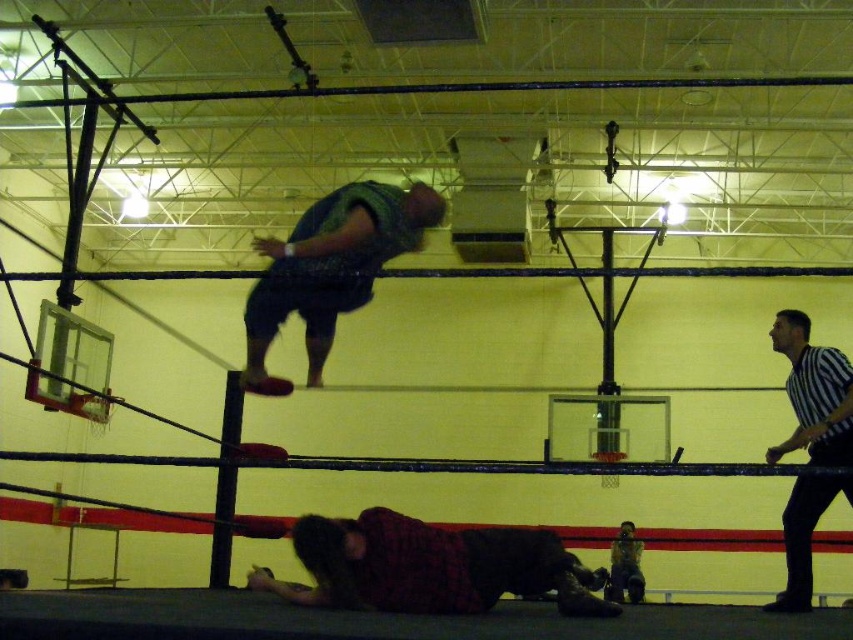
Based on the scene description, where is the plaid shirt at lower center located in the image?

The plaid shirt at lower center is located at point coordinates of 0.886 on the x axis and 0.504 on the y axis.

You are a referee in the gymnasium. You need to ensure the wrestlers are within the ring, which has a 1.5 meter radius. Can you confirm if both the plaid shirt at lower center and the green textured shirt at upper center are inside the ring?

The distance between the plaid shirt at lower center and the green textured shirt at upper center is 1.28 meters, which is less than the ring radius of 1.5 meters. Therefore, both wrestlers are within the ring.

In the scene shown: You are a referee in the wrestling match. You need to ensure the wrestlers are within the ring boundaries. The ring is 2 meters in diameter. Are both the plaid shirt at lower center and the black striped shirt at right inside the ring?

The plaid shirt at lower center is 1.91 meters away from the black striped shirt at right. Since the ring is 2 meters in diameter, the distance between them is within the ring boundaries, so both are inside the ring.